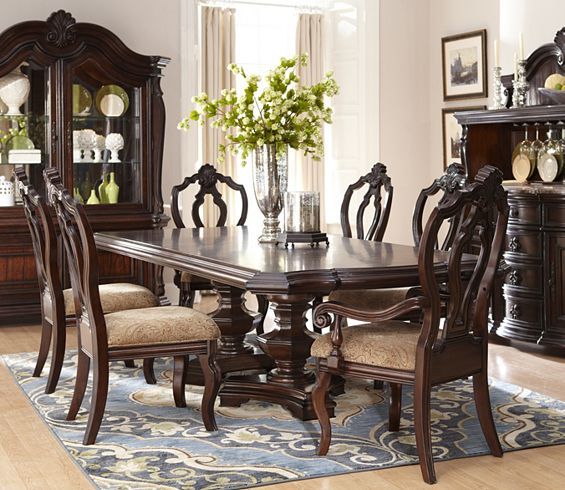
The width and height of the screenshot is (565, 490). Identify the location of drawers. (521, 207), (523, 238), (528, 278), (529, 302).